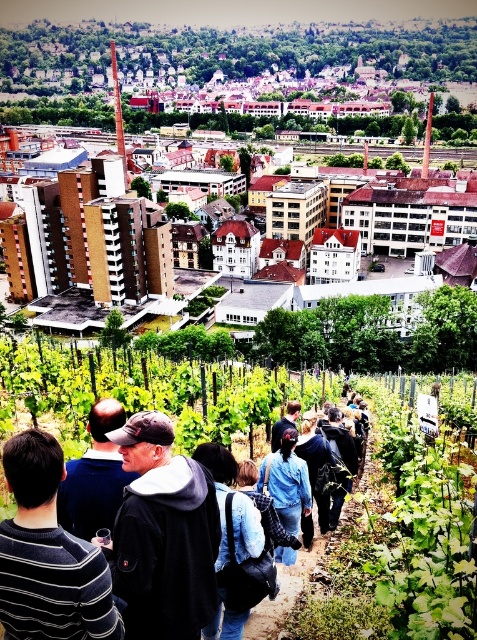
Between point (155, 580) and point (322, 540), which one is positioned behind?

The point (322, 540) is behind.

Is the position of black hoodie at center less distant than that of dark blue fabric at center?

Yes, it is in front of dark blue fabric at center.

Is point (208, 566) less distant than point (307, 576)?

Yes.

The image size is (477, 640). I want to click on black hoodie at center, so click(163, 536).

Measure the distance between matte brown buildings at center and camera.

The distance of matte brown buildings at center from camera is 566.06 feet.

Is matte brown buildings at center above denim jacket at center?

Yes.

Which is behind, point (422, 109) or point (290, 497)?

The point (422, 109) is behind.

Locate an element on the screen. matte brown buildings at center is located at coordinates (239, 76).

Is point (99, 58) more distant than point (165, 448)?

Yes, point (99, 58) is behind point (165, 448).

Which of these two, matte brown buildings at center or black hoodie at center, stands taller?

matte brown buildings at center

Is point (51, 26) more distant than point (205, 476)?

Yes.

The width and height of the screenshot is (477, 640). Find the location of `matte brown buildings at center`. matte brown buildings at center is located at coordinates (239, 76).